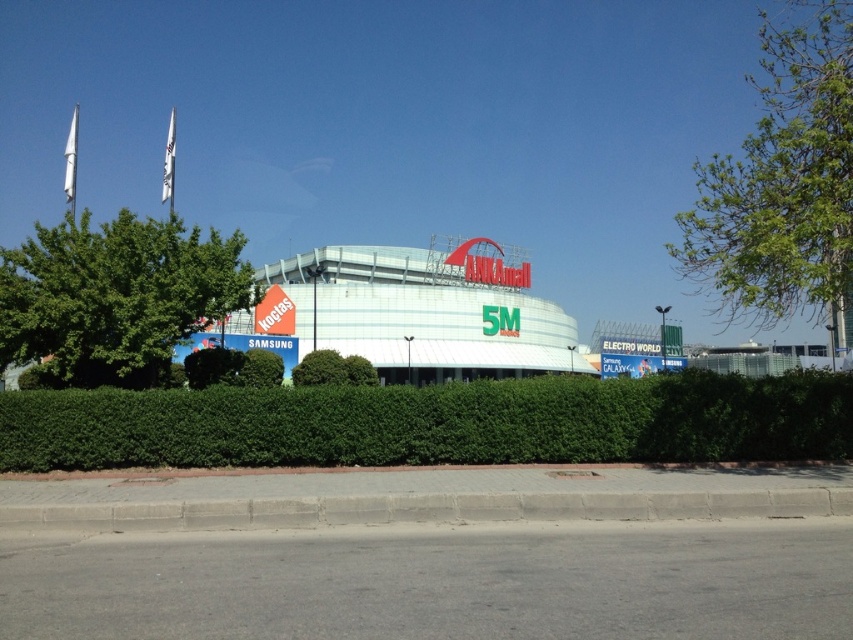
Question: Which point appears farthest from the camera in this image?

Choices:
 (A) (233, 237)
 (B) (737, 241)
 (C) (457, 348)

Answer: (C)

Question: Which of the following is the closest to the observer?

Choices:
 (A) green leafy tree at right
 (B) white glossy stadium at center

Answer: (A)

Question: Which point is farther from the camera taking this photo?

Choices:
 (A) (427, 288)
 (B) (57, 454)

Answer: (A)

Question: In this image, where is green leafy hedge at center located relative to green leafy tree at left?

Choices:
 (A) above
 (B) below

Answer: (B)

Question: Is green leafy tree at right to the left of green leafy tree at left from the viewer's perspective?

Choices:
 (A) no
 (B) yes

Answer: (A)

Question: Is green leafy hedge at center wider than white glossy stadium at center?

Choices:
 (A) no
 (B) yes

Answer: (A)